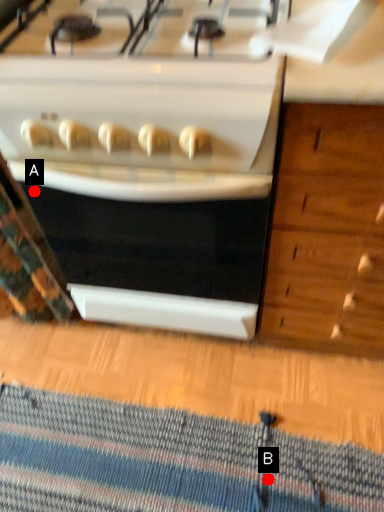
Question: Two points are circled on the image, labeled by A and B beside each circle. Which point is farther from the camera taking this photo?

Choices:
 (A) A is further
 (B) B is further

Answer: (A)